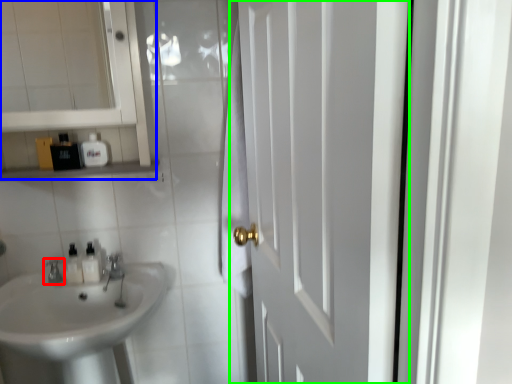
Question: Based on their relative distances, which object is nearer to tap (highlighted by a red box)? Choose from medicine cabinet (highlighted by a blue box) and door (highlighted by a green box).

Choices:
 (A) medicine cabinet
 (B) door

Answer: (A)